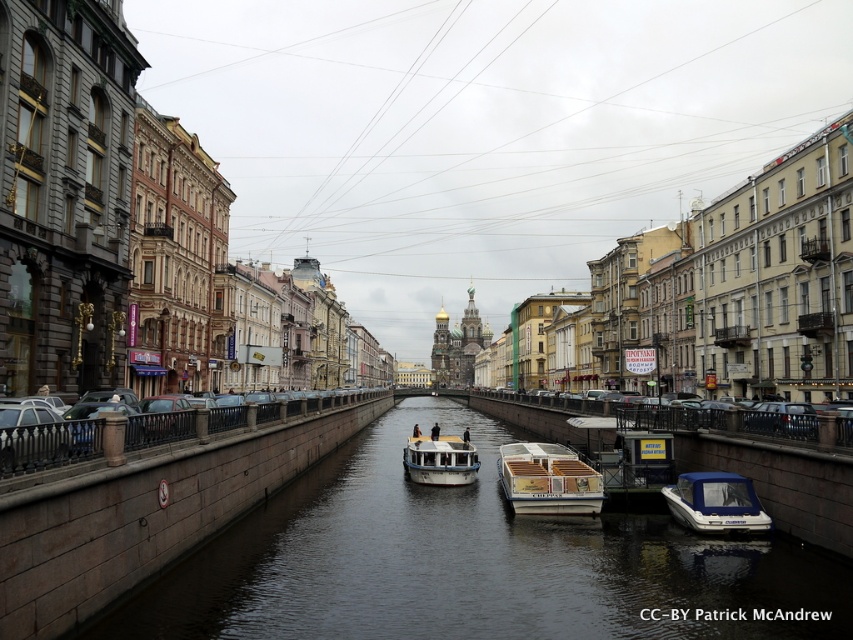
Who is more forward, (59, 461) or (410, 468)?

Point (59, 461)

Does point (62, 449) lie behind point (405, 449)?

No.

The height and width of the screenshot is (640, 853). What are the coordinates of `matte black car at left` in the screenshot? It's located at [48, 444].

Who is more forward, (506, 621) or (4, 448)?

Positioned in front is point (4, 448).

Is brown stone canal at center wider than matte black car at left?

Indeed, brown stone canal at center has a greater width compared to matte black car at left.

Which is behind, point (363, 445) or point (84, 419)?

The point (363, 445) is more distant.

The width and height of the screenshot is (853, 640). What are the coordinates of `brown stone canal at center` in the screenshot? It's located at (469, 563).

Is brown stone canal at center above wooden deck boat at center?

No.

Is point (682, 552) farther from camera compared to point (590, 497)?

That is False.

The width and height of the screenshot is (853, 640). I want to click on brown stone canal at center, so click(x=469, y=563).